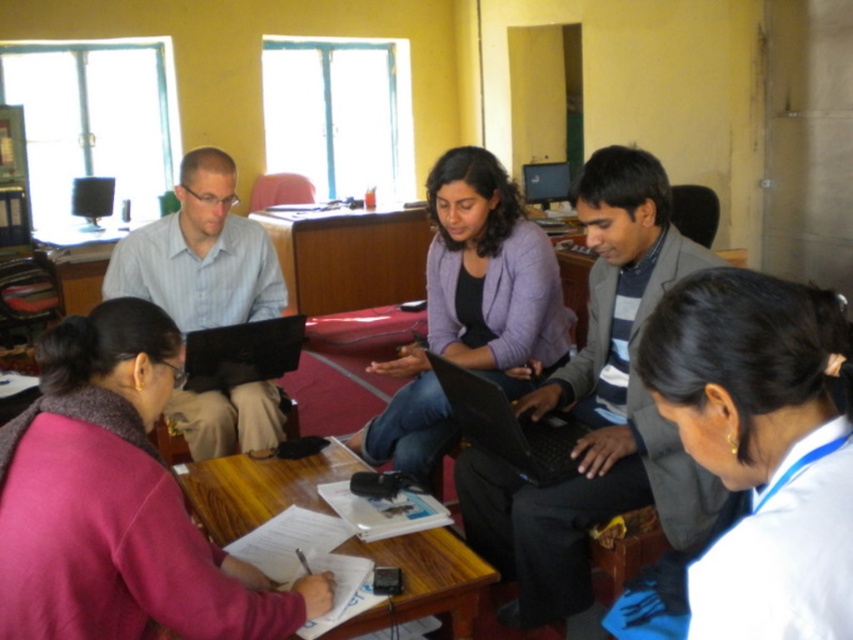
Consider the image. Is purple matte sweater at center positioned behind black glossy laptop at center?

No, purple matte sweater at center is closer to the viewer.

Which is above, purple matte sweater at center or black glossy laptop at center?

purple matte sweater at center is higher up.

Is point (540, 337) positioned after point (225, 365)?

No.

Image resolution: width=853 pixels, height=640 pixels. I want to click on purple matte sweater at center, so click(x=471, y=310).

Measure the distance between point [737,412] and camera.

→ 85.21 centimeters

This screenshot has width=853, height=640. In order to click on white fabric at lower right in this screenshot , I will do `click(759, 448)`.

Where is `white fabric at lower right`? The width and height of the screenshot is (853, 640). white fabric at lower right is located at coordinates (759, 448).

Looking at this image, how far apart are black matte laptop at center and black glossy laptop at center?

31.52 inches

Which is in front, point (453, 397) or point (209, 385)?

Point (453, 397)

Identify the location of black matte laptop at center. (508, 426).